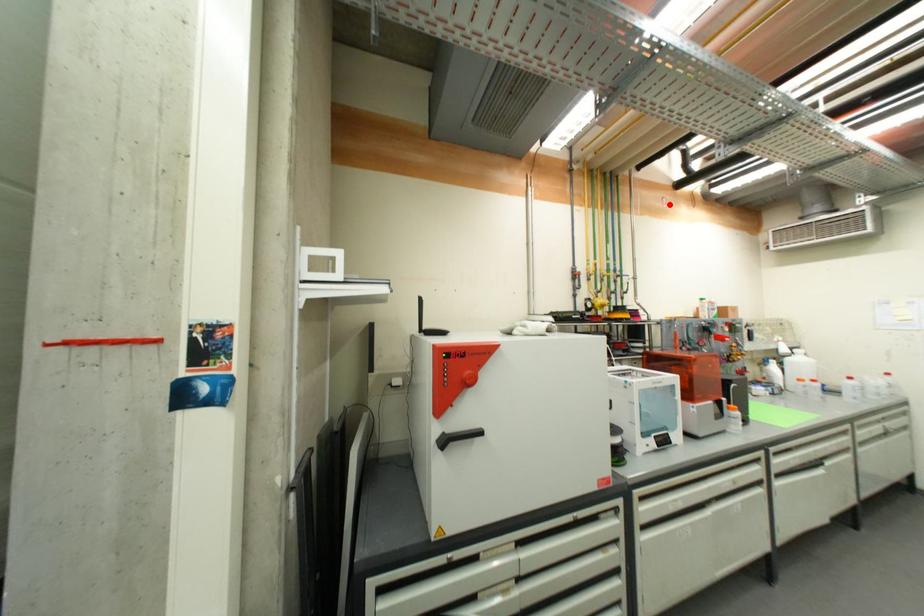
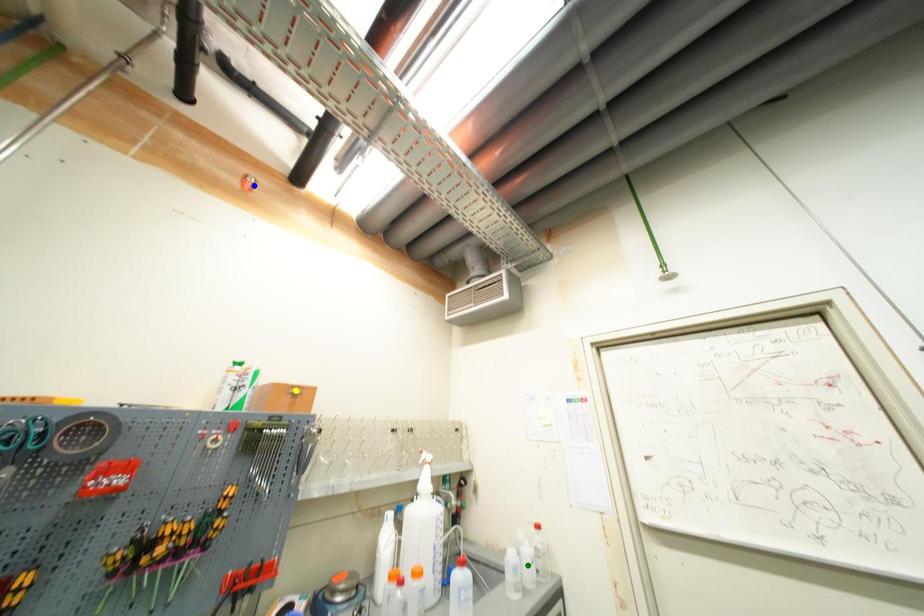
Question: I am providing you with two images of the same scene from different viewpoints. A red point is marked on the first image. You are given multiple points on the second image. In image 2, which mark is for the same physical point as the one in image 1?

Choices:
 (A) yellow point
 (B) blue point
 (C) green point

Answer: (B)